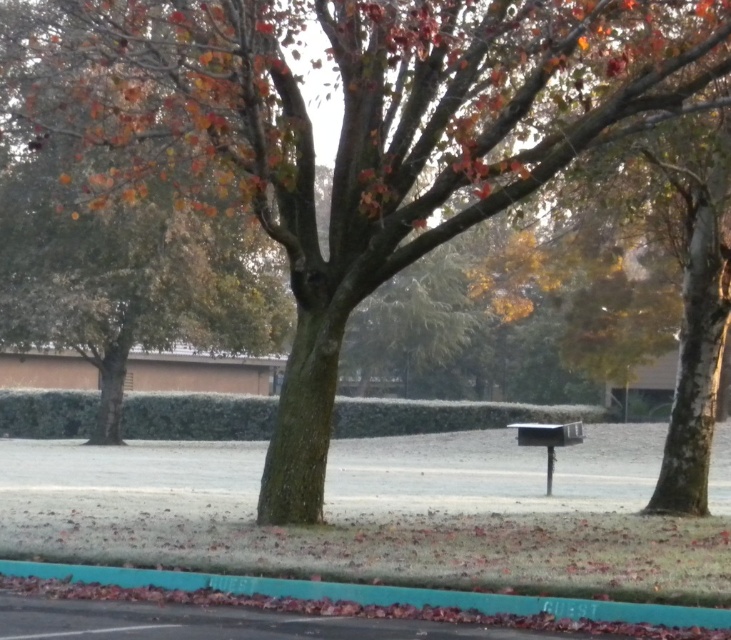
You are a delivery person approaching the teal rubber curb at lower center and the metallic silver mailbox at center. Based on the scene, which object is closer to the left side of the frame?

The teal rubber curb at lower center is closer to the left side of the frame because it is positioned to the left of the metallic silver mailbox at center.

You are a delivery person trying to park your van in the GUEST parking area. The van is 2 meters wide. The teal rubber curb at lower center marks the parking spot. Can you fit your van into the parking space if the curb is wider than the metallic silver mailbox at center?

The teal rubber curb at lower center might be wider than the metallic silver mailbox at center. Since the curb is wider than the mailbox, and the van is 2 meters wide, it is possible that the parking space is wide enough for the van. However, without exact measurements, we cannot be certain. The answer is inconclusive based on the given information.